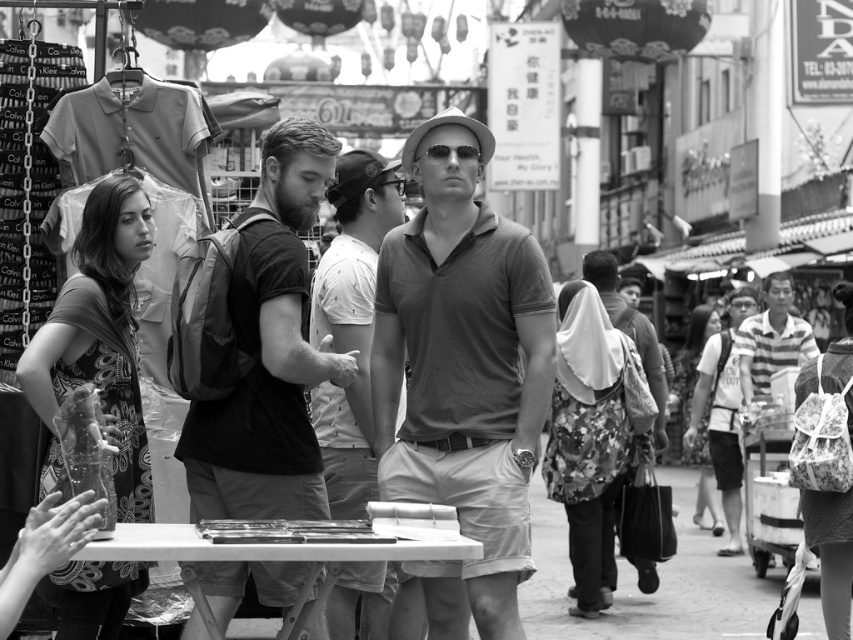
Question: Can you confirm if smooth gray shirt at center is positioned to the right of floral fabric bag at center-right?

Choices:
 (A) yes
 (B) no

Answer: (B)

Question: From the image, what is the correct spatial relationship of patterned fabric dress at left in relation to floral fabric bag at center-right?

Choices:
 (A) above
 (B) below

Answer: (A)

Question: Is smooth gray shirt at center below floral fabric bag at right?

Choices:
 (A) yes
 (B) no

Answer: (B)

Question: Which object appears farthest from the camera in this image?

Choices:
 (A) patterned fabric dress at left
 (B) floral fabric bag at center-right

Answer: (B)

Question: Which object is closer to the camera taking this photo?

Choices:
 (A) dark gray backpack at center
 (B) matte gray polo shirt at center
 (C) floral fabric bag at right
 (D) patterned fabric dress at left

Answer: (A)

Question: Which of the following is the farthest from the observer?

Choices:
 (A) (306, 150)
 (B) (520, 541)
 (C) (374, 573)
 (D) (843, 618)

Answer: (D)